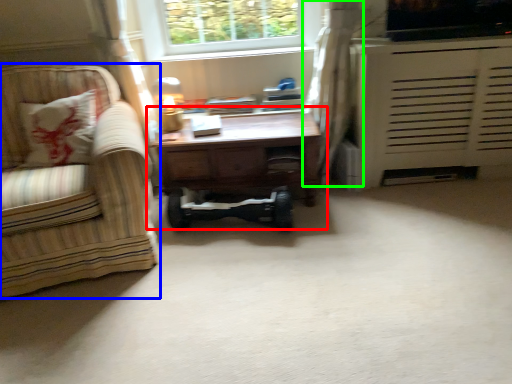
Question: Estimate the real-world distances between objects in this image. Which object is closer to table (highlighted by a red box), chair (highlighted by a blue box) or curtain (highlighted by a green box)?

Choices:
 (A) chair
 (B) curtain

Answer: (B)